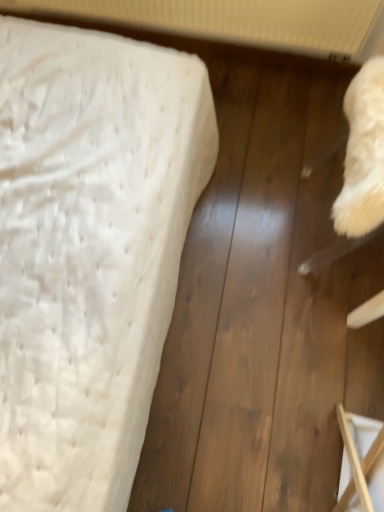
Question: In the image, is white textured radiator at upper center positioned in front of or behind wooden frame at lower right?

Choices:
 (A) front
 (B) behind

Answer: (B)

Question: In terms of size, does white textured radiator at upper center appear bigger or smaller than wooden frame at lower right?

Choices:
 (A) big
 (B) small

Answer: (A)

Question: Which of these objects is positioned closest to the white textured radiator at upper center?

Choices:
 (A) wooden frame at lower right
 (B) white textured mattress at left

Answer: (B)

Question: Which object is the closest to the white textured mattress at left?

Choices:
 (A) white textured radiator at upper center
 (B) wooden frame at lower right

Answer: (B)